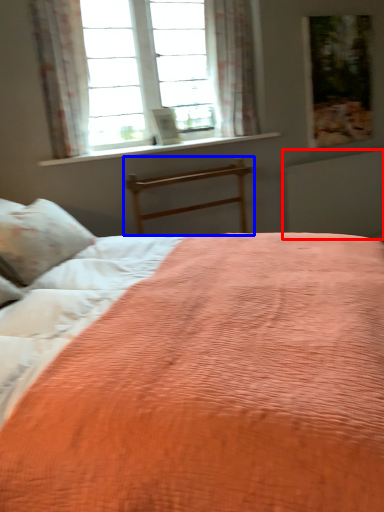
Question: Among these objects, which one is nearest to the camera, radiator (highlighted by a red box) or bed frame (highlighted by a blue box)?

Choices:
 (A) radiator
 (B) bed frame

Answer: (B)